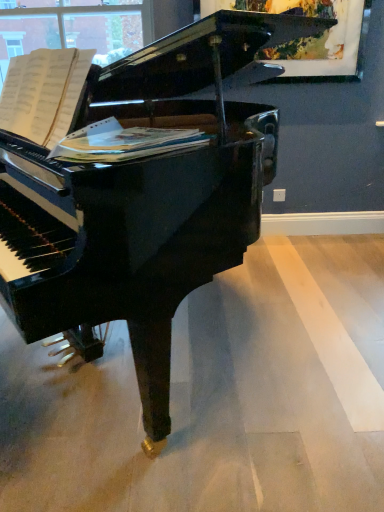
Question: Is white paper at center bigger than wooden picture frame at upper right?

Choices:
 (A) yes
 (B) no

Answer: (B)

Question: From a real-world perspective, is white paper at center positioned under wooden picture frame at upper right based on gravity?

Choices:
 (A) yes
 (B) no

Answer: (A)

Question: Does white paper at center appear on the left side of wooden picture frame at upper right?

Choices:
 (A) no
 (B) yes

Answer: (B)

Question: Can you confirm if white paper at center is thinner than wooden picture frame at upper right?

Choices:
 (A) yes
 (B) no

Answer: (B)

Question: From the image's perspective, does white paper at center appear higher than wooden picture frame at upper right?

Choices:
 (A) yes
 (B) no

Answer: (B)

Question: Is white paper at center facing towards wooden picture frame at upper right?

Choices:
 (A) yes
 (B) no

Answer: (B)

Question: Can you confirm if wooden picture frame at upper right is positioned to the right of white paper at center?

Choices:
 (A) yes
 (B) no

Answer: (A)

Question: Is wooden picture frame at upper right next to white paper at center?

Choices:
 (A) yes
 (B) no

Answer: (B)

Question: Can you confirm if wooden picture frame at upper right is thinner than white paper at center?

Choices:
 (A) yes
 (B) no

Answer: (A)

Question: Is wooden picture frame at upper right wider than white paper at center?

Choices:
 (A) yes
 (B) no

Answer: (B)

Question: From a real-world perspective, is wooden picture frame at upper right under white paper at center?

Choices:
 (A) yes
 (B) no

Answer: (B)

Question: Is wooden picture frame at upper right further to the viewer compared to white paper at center?

Choices:
 (A) yes
 (B) no

Answer: (A)

Question: In the image, is white paper at center positioned in front of or behind wooden picture frame at upper right?

Choices:
 (A) front
 (B) behind

Answer: (A)